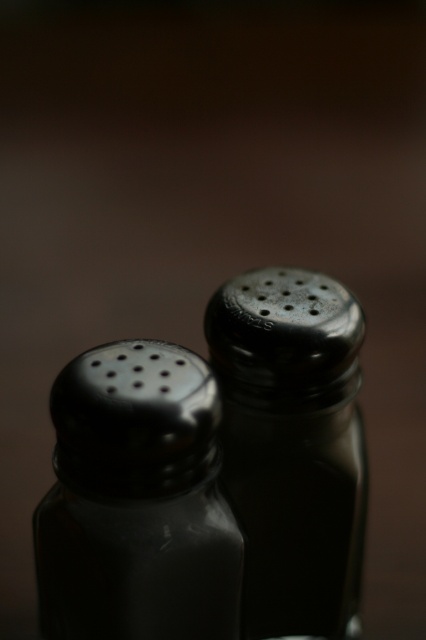
Question: Does satin black salt shaker at center appear under satin black pepper shaker at center?

Choices:
 (A) no
 (B) yes

Answer: (B)

Question: Among these points, which one is farthest from the camera?

Choices:
 (A) (201, 612)
 (B) (235, 317)

Answer: (B)

Question: Is satin black salt shaker at center to the left of satin black pepper shaker at center from the viewer's perspective?

Choices:
 (A) yes
 (B) no

Answer: (A)

Question: Does satin black salt shaker at center lie in front of satin black pepper shaker at center?

Choices:
 (A) yes
 (B) no

Answer: (A)

Question: Which object appears closest to the camera in this image?

Choices:
 (A) satin black salt shaker at center
 (B) satin black pepper shaker at center

Answer: (A)